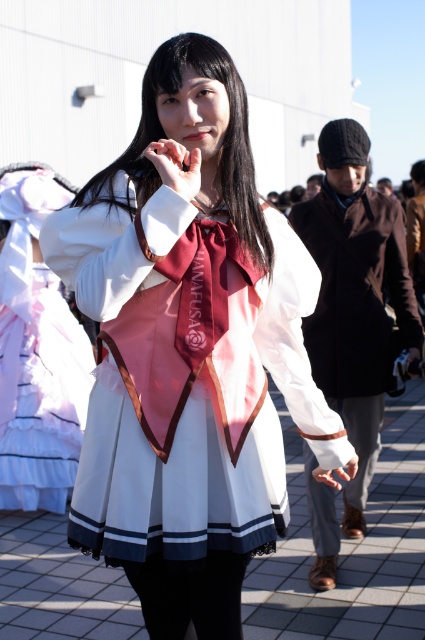
You are at a cosplay event and see the white satin dress at center and the leather brown wristband at lower right. Which object is taller?

The white satin dress at center is much taller than the leather brown wristband at lower right.

You are at a cosplay event and see a person dressed in a costume resembling a traditional Japanese school uniform from the anime Hana to Yume. The costume includes a white blouse with puffed sleeves, a red and white striped scarf, a pleated skirt with navy blue trim, black tights, and brown shoes. There are other attendees in costumes in the background. You notice a point at coordinates (183, 358). Based on the scene, what object is this point located on?

The point at coordinates (183, 358) is located on the white satin dress at center.